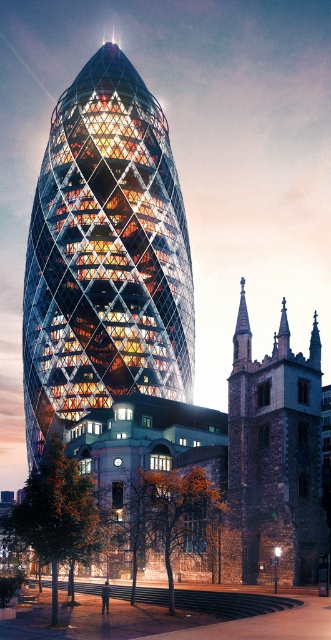
Does glassy orange building at center have a greater width compared to dark brown stone tower at lower right?

Yes, glassy orange building at center is wider than dark brown stone tower at lower right.

Does glassy orange building at center come behind dark brown stone tower at lower right?

Yes, glassy orange building at center is further from the viewer.

This screenshot has width=331, height=640. What do you see at coordinates (104, 257) in the screenshot? I see `glassy orange building at center` at bounding box center [104, 257].

Locate an element on the screen. Image resolution: width=331 pixels, height=640 pixels. glassy orange building at center is located at coordinates (104, 257).